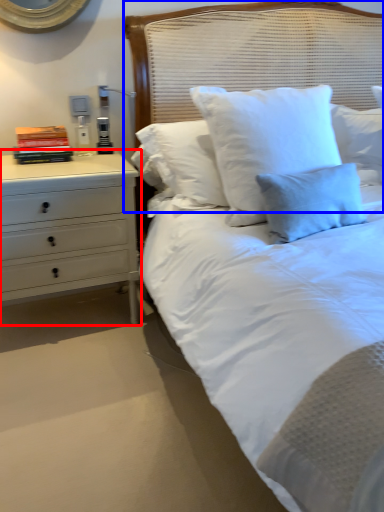
Question: Among these objects, which one is farthest to the camera, chest of drawers (highlighted by a red box) or headboard (highlighted by a blue box)?

Choices:
 (A) chest of drawers
 (B) headboard

Answer: (A)